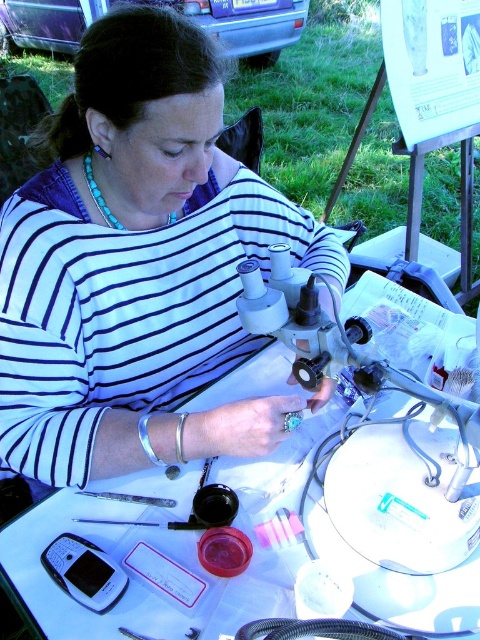
You are a photographer trying to capture the scene of the person working. You want to ensure the white striped shirt at center and the white plastic table at center are both clearly visible in your photo. Based on their positions, which object should you focus on first to ensure both are in frame?

The white striped shirt at center is to the left of the white plastic table at center, so focusing on the white plastic table at center first would allow both objects to be captured in the frame since the shirt is positioned to its left.

You are standing at the position of point [66,625] and want to move towards point [160,273]. According to the scene, will you be moving forward or backward?

Since point [160,273] is behind point [66,625], moving towards it would mean moving backward.

Where is the white striped shirt at center located in the image?

The white striped shirt at center is located at point (137, 266) in the image.